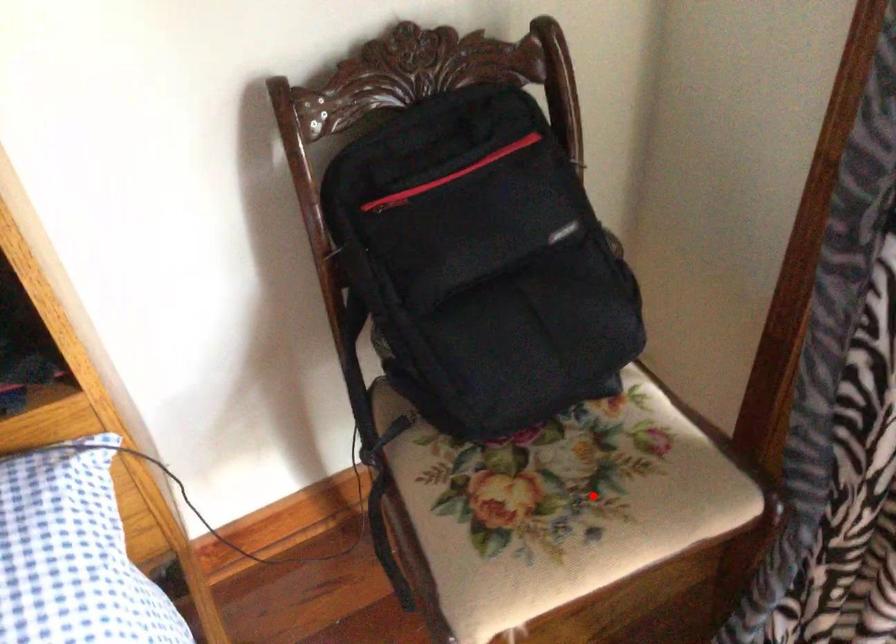
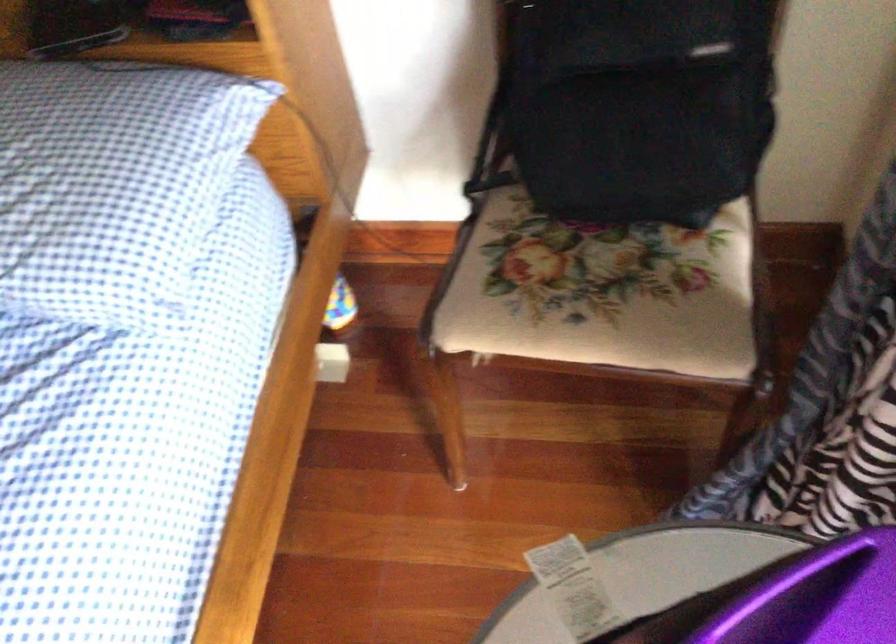
Question: I am providing you with two images of the same scene from different viewpoints. In image1, a red point is highlighted. Considering the same 3D point in image2, which of the following is correct?

Choices:
 (A) It is closer
 (B) It is farther

Answer: (B)